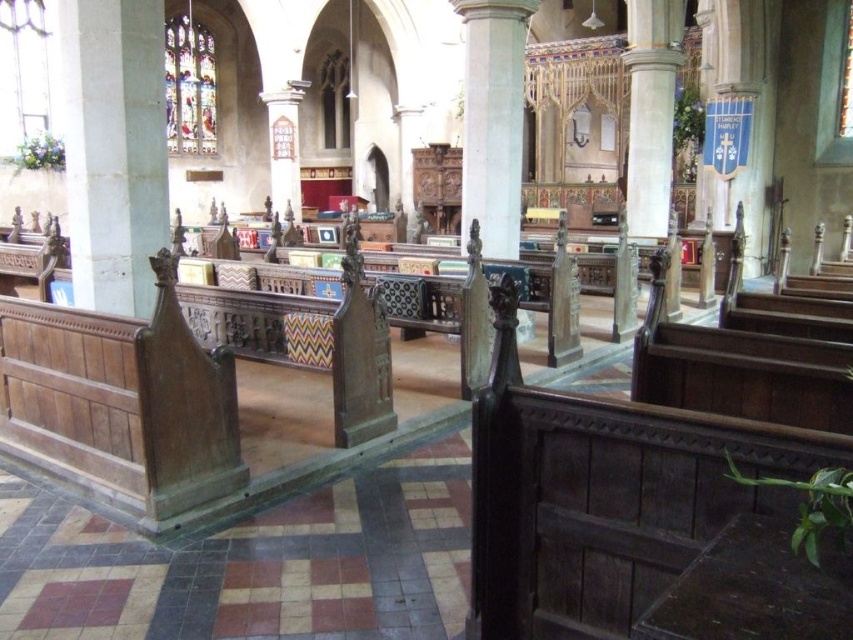
Can you confirm if white stone pillar at left is bigger than white stone column at center?

Indeed, white stone pillar at left has a larger size compared to white stone column at center.

From the picture: Is white stone pillar at left to the left of white stone column at center from the viewer's perspective?

Yes, white stone pillar at left is to the left of white stone column at center.

Identify the location of white stone pillar at left. (114, 148).

Locate an element on the screen. The height and width of the screenshot is (640, 853). white stone pillar at left is located at coordinates (114, 148).